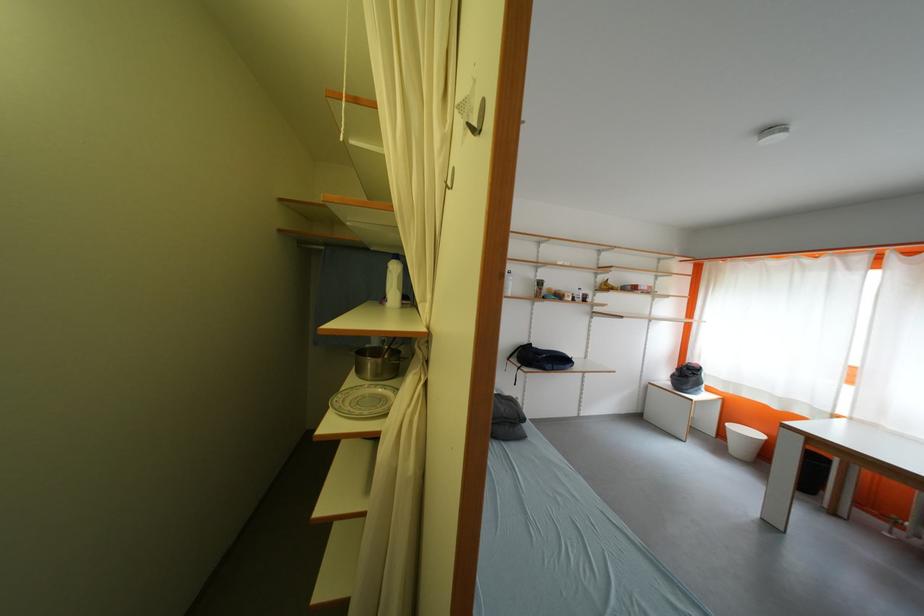
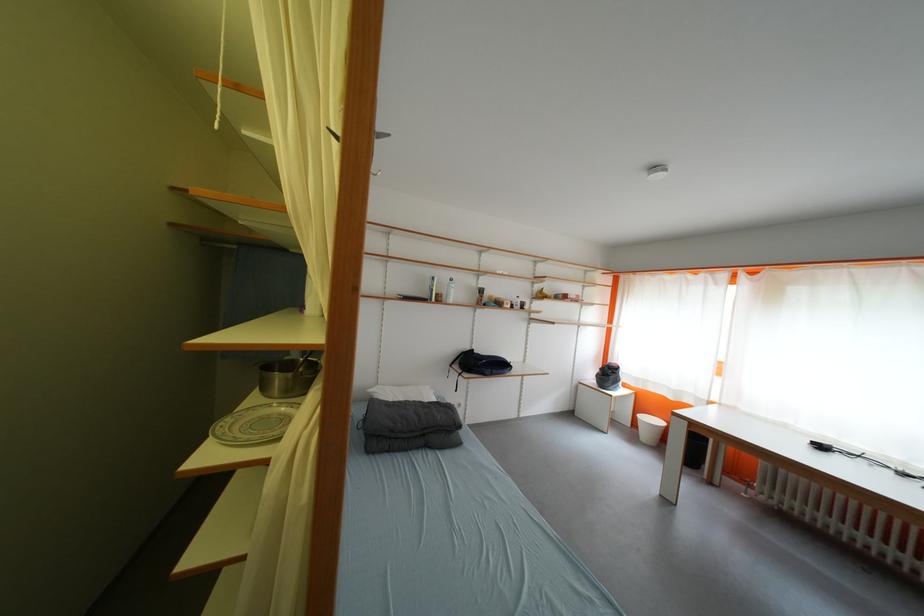
Question: Which direction would the cameraman need to move to produce the second image? Reply with the corresponding letter.

Choices:
 (A) Left
 (B) Right
 (C) Forward
 (D) Backward

Answer: (B)